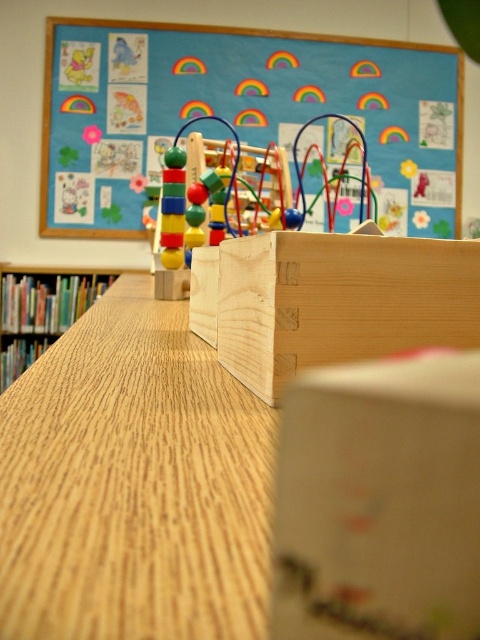
Can you confirm if white matte box at center is smaller than multicolored wooden beads at center?

Yes, white matte box at center is smaller than multicolored wooden beads at center.

Is white matte box at center shorter than multicolored wooden beads at center?

Correct, white matte box at center is not as tall as multicolored wooden beads at center.

The image size is (480, 640). What do you see at coordinates (380, 500) in the screenshot?
I see `white matte box at center` at bounding box center [380, 500].

Image resolution: width=480 pixels, height=640 pixels. What are the coordinates of `white matte box at center` in the screenshot? It's located at (380, 500).

How far apart are matte wooden board at upper center and white matte box at center?

4.31 meters

Is matte wooden board at upper center below white matte box at center?

No.

Locate an element on the screen. matte wooden board at upper center is located at coordinates (236, 109).

In order to click on matte wooden board at upper center in this screenshot , I will do `click(236, 109)`.

Find the location of `natural wood box at center`. natural wood box at center is located at coordinates (338, 301).

Who is positioned more to the left, natural wood box at center or wooden bookshelf at left?

From the viewer's perspective, wooden bookshelf at left appears more on the left side.

Which is behind, point (286, 262) or point (69, 314)?

Positioned behind is point (69, 314).

At what (x,y) coordinates should I click in order to perform the action: click on natural wood box at center. Please return your answer as a coordinate pair (x, y). The image size is (480, 640). Looking at the image, I should click on (338, 301).